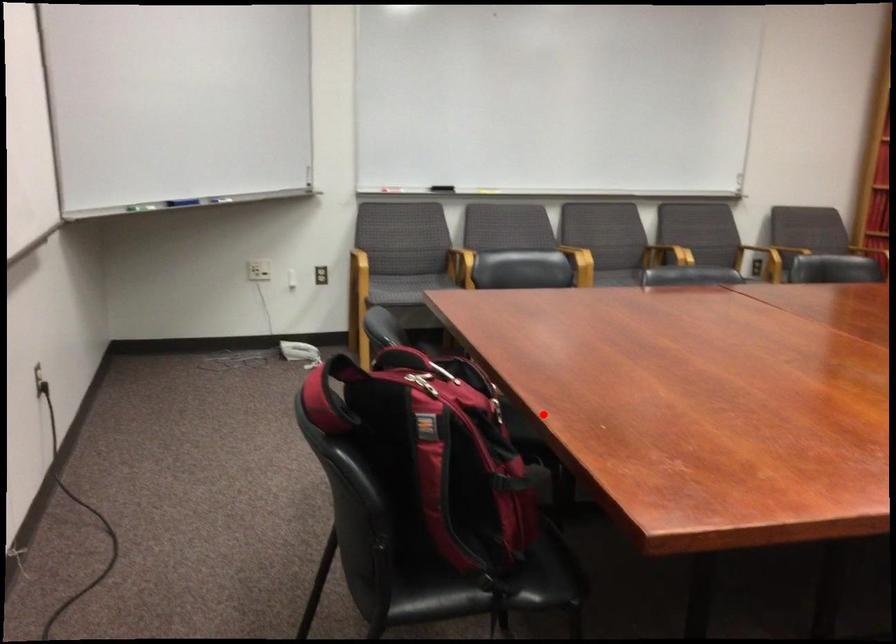
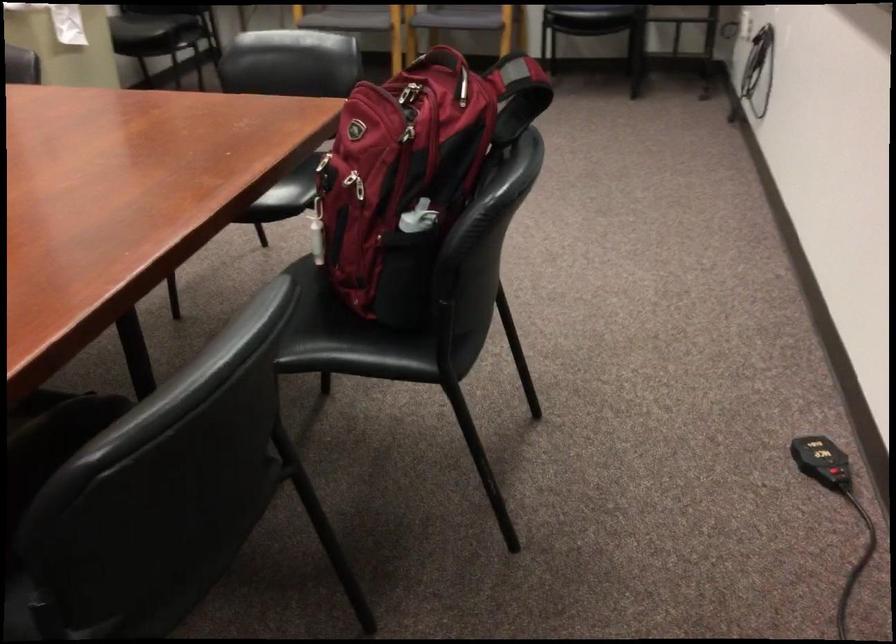
Question: I am providing you with two images of the same scene from different viewpoints. Image1 has a red point marked. In image2, the corresponding 3D location appears at what relative position? Reply with the corresponding letter.

Choices:
 (A) Closer
 (B) Farther

Answer: (A)